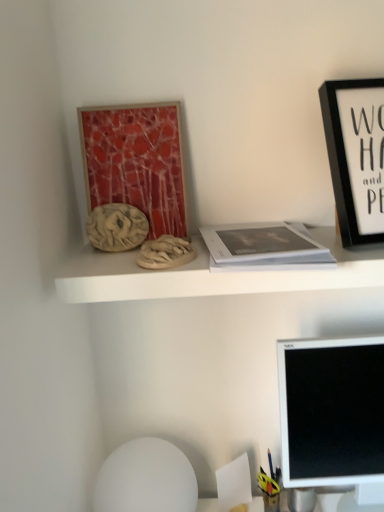
Question: From a real-world perspective, is black matte picture frame at upper right physically below white matte book at center?

Choices:
 (A) yes
 (B) no

Answer: (B)

Question: Is black matte picture frame at upper right thinner than white matte book at center?

Choices:
 (A) yes
 (B) no

Answer: (A)

Question: Considering the relative positions of black matte picture frame at upper right and white matte book at center in the image provided, is black matte picture frame at upper right in front of white matte book at center?

Choices:
 (A) yes
 (B) no

Answer: (B)

Question: Is black matte picture frame at upper right facing away from white matte book at center?

Choices:
 (A) no
 (B) yes

Answer: (A)

Question: From the image's perspective, is black matte picture frame at upper right on white matte book at center?

Choices:
 (A) yes
 (B) no

Answer: (A)

Question: From the image's perspective, is white matte sphere at lower center positioned above or below matte red mosaic art at upper left?

Choices:
 (A) above
 (B) below

Answer: (B)

Question: Do you think white matte sphere at lower center is within matte red mosaic art at upper left, or outside of it?

Choices:
 (A) inside
 (B) outside

Answer: (B)

Question: In terms of height, does white matte sphere at lower center look taller or shorter compared to matte red mosaic art at upper left?

Choices:
 (A) short
 (B) tall

Answer: (A)

Question: In terms of size, does white matte sphere at lower center appear bigger or smaller than matte red mosaic art at upper left?

Choices:
 (A) big
 (B) small

Answer: (A)

Question: From a real-world perspective, relative to matte wood shelf at upper center, is white matte sphere at lower center vertically above or below?

Choices:
 (A) above
 (B) below

Answer: (B)

Question: Looking at the image, does white matte sphere at lower center seem bigger or smaller compared to matte wood shelf at upper center?

Choices:
 (A) big
 (B) small

Answer: (A)

Question: From the image's perspective, relative to matte wood shelf at upper center, is white matte sphere at lower center above or below?

Choices:
 (A) above
 (B) below

Answer: (B)

Question: Do you think white matte sphere at lower center is within matte wood shelf at upper center, or outside of it?

Choices:
 (A) outside
 (B) inside

Answer: (A)

Question: Do you think white matte book at center is within matte red mosaic art at upper left, or outside of it?

Choices:
 (A) outside
 (B) inside

Answer: (A)

Question: From the image's perspective, is white matte book at center positioned above or below matte red mosaic art at upper left?

Choices:
 (A) above
 (B) below

Answer: (B)